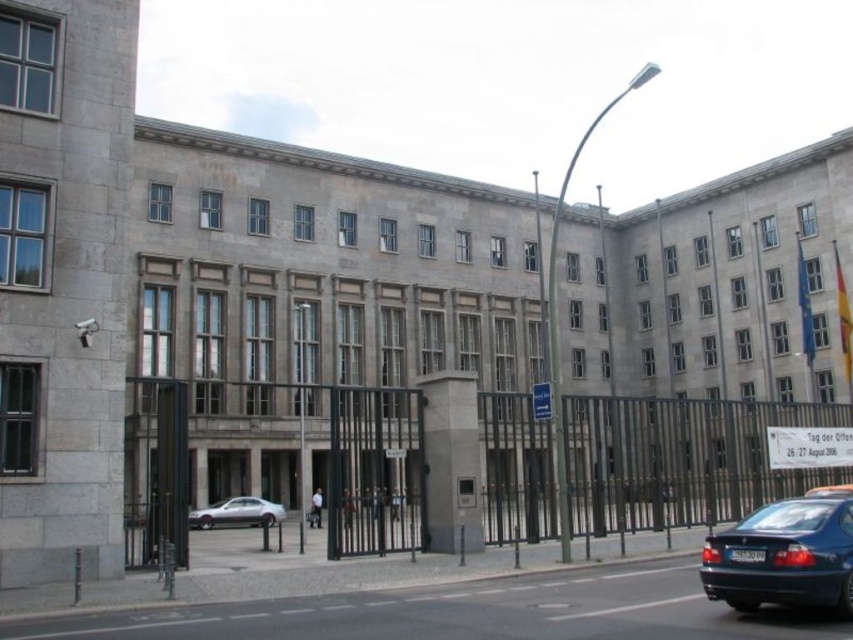
You are a pedestrian standing in front of the building and want to hail the metallic silver taxi at center. Can you reach the taxi without going through the black metal fence at center?

The metallic silver taxi at center is behind the black metal fence at center, so you would need to go through the fence to reach it.

You are a delivery person trying to park your vehicle in the parking lot behind the building. You have a silver metallic car at lower left and a metallic silver taxi at center. Which vehicle will require less space to park?

The silver metallic car at lower left has a smaller width than the metallic silver taxi at center, so it requires less space to park.

You are a delivery driver who needs to park your vehicle in front of the building. The shiny blue sedan at lower right and the metallic silver taxi at center are already parked there. Which vehicle should you avoid parking next to if you want to leave first?

You should avoid parking next to the metallic silver taxi at center because the shiny blue sedan at lower right is smaller and would require less space to maneuver around, allowing you to leave more easily.